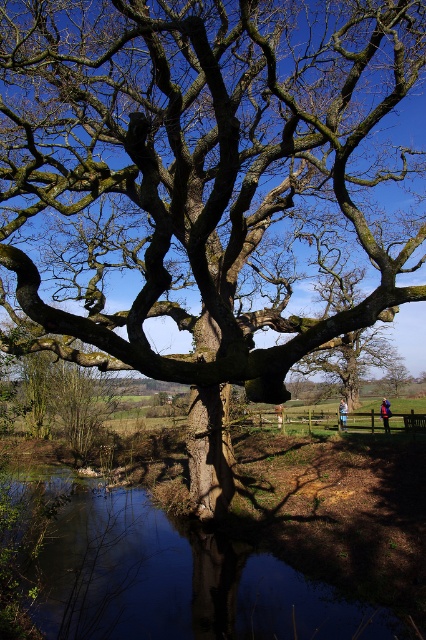
Question: Can you confirm if smooth reflective water at lower center is smaller than blue fabric jacket at center?

Choices:
 (A) yes
 (B) no

Answer: (B)

Question: Which object appears farthest from the camera in this image?

Choices:
 (A) blue fabric jacket at lower right
 (B) blue fabric jacket at center

Answer: (A)

Question: Where is smooth reflective water at lower center located in relation to blue fabric jacket at lower right in the image?

Choices:
 (A) above
 (B) below

Answer: (A)

Question: Is smooth reflective water at lower center further to the viewer compared to blue fabric jacket at center?

Choices:
 (A) no
 (B) yes

Answer: (A)

Question: Which object is closer to the camera taking this photo?

Choices:
 (A) blue fabric jacket at lower right
 (B) blue fabric jacket at center
 (C) smooth reflective water at lower center

Answer: (C)

Question: Which of the following is the farthest from the observer?

Choices:
 (A) (345, 424)
 (B) (385, 403)

Answer: (B)